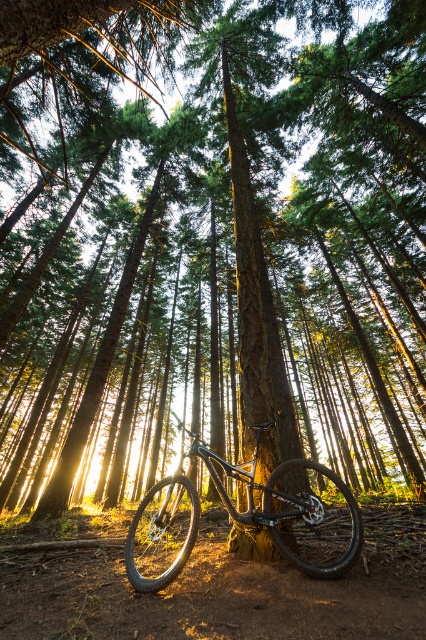
Based on the photo, does dirt track at center appear on the right side of glossy metallic bicycle at center?

Indeed, dirt track at center is positioned on the right side of glossy metallic bicycle at center.

Is dirt track at center to the left of glossy metallic bicycle at center from the viewer's perspective?

Incorrect, dirt track at center is not on the left side of glossy metallic bicycle at center.

Image resolution: width=426 pixels, height=640 pixels. What are the coordinates of `dirt track at center` in the screenshot? It's located at (210, 596).

In order to click on dirt track at center in this screenshot , I will do `click(210, 596)`.